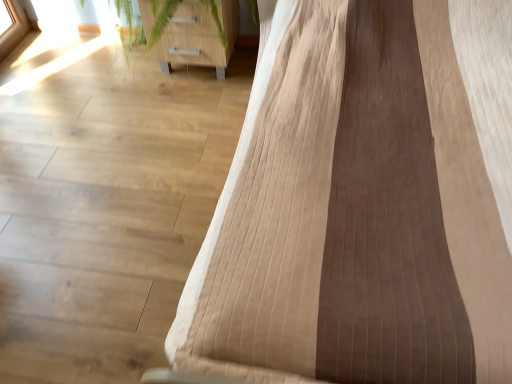
Question: In the image, is brown textured fabric at right, which is counted as the second furniture, starting from the left, on the left side or the right side of wooden cabinet at upper left, which is the 2th furniture from right to left?

Choices:
 (A) right
 (B) left

Answer: (A)

Question: Is brown textured fabric at right, the first furniture when ordered from right to left, inside or outside of wooden cabinet at upper left, which appears as the 1th furniture when viewed from the left?

Choices:
 (A) inside
 (B) outside

Answer: (B)

Question: Considering the positions of brown textured fabric at right, which is counted as the second furniture, starting from the left, and wooden cabinet at upper left, which appears as the 1th furniture when viewed from the left, in the image, is brown textured fabric at right, which is counted as the second furniture, starting from the left, taller or shorter than wooden cabinet at upper left, which appears as the 1th furniture when viewed from the left,?

Choices:
 (A) tall
 (B) short

Answer: (A)

Question: Is wooden cabinet at upper left, which is the 2th furniture from right to left, bigger or smaller than brown textured fabric at right, which is counted as the second furniture, starting from the left?

Choices:
 (A) big
 (B) small

Answer: (B)

Question: Considering the positions of point (220, 54) and point (467, 67), is point (220, 54) closer or farther from the camera than point (467, 67)?

Choices:
 (A) farther
 (B) closer

Answer: (A)

Question: Choose the correct answer: Is wooden cabinet at upper left, which is the 2th furniture from right to left, inside brown textured fabric at right, the first furniture when ordered from right to left, or outside it?

Choices:
 (A) inside
 (B) outside

Answer: (B)

Question: From their relative heights in the image, would you say wooden cabinet at upper left, which is the 2th furniture from right to left, is taller or shorter than brown textured fabric at right, the first furniture when ordered from right to left?

Choices:
 (A) tall
 (B) short

Answer: (B)